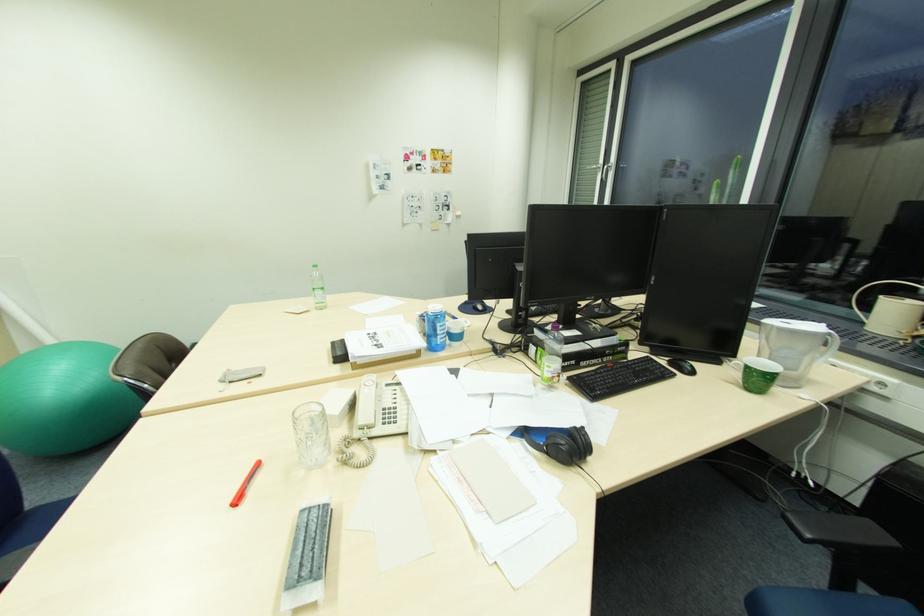
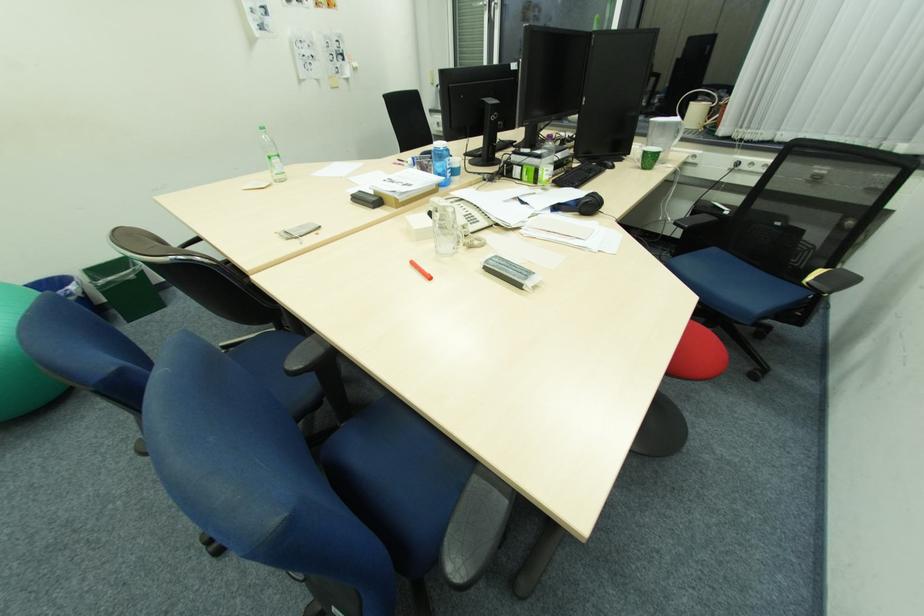
Find the pixel in the second image that matches point 306,552 in the first image.

(517, 270)